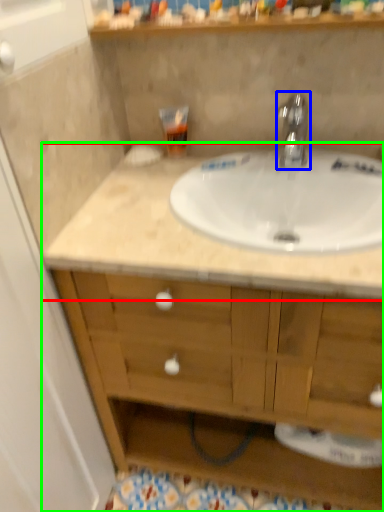
Question: Which is farther away from countertop (highlighted by a red box)? tap (highlighted by a blue box) or bathroom cabinet (highlighted by a green box)?

Choices:
 (A) tap
 (B) bathroom cabinet

Answer: (A)